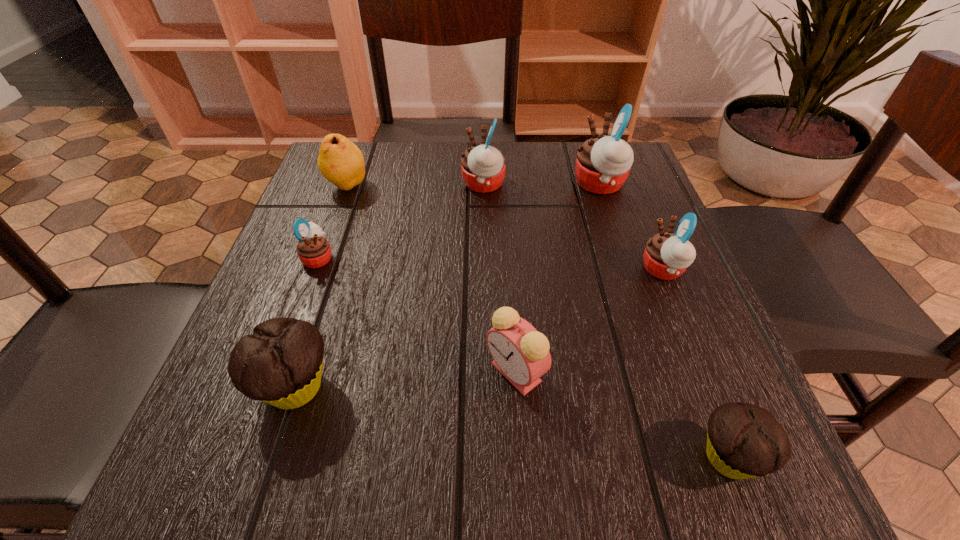
Select which muffin is the fifth closest to the bigger chocolate muffin. Please provide its 2D coordinates. Your answer should be formatted as a tuple, i.e. [(x, y)], where the tuple contains the x and y coordinates of a point satisfying the conditions above.

[(603, 163)]

Where is `muffin that is the fourth nearest to the third biggest pink muffin`? This screenshot has width=960, height=540. muffin that is the fourth nearest to the third biggest pink muffin is located at coordinates tap(281, 363).

Choose which pink muffin is the nearest neighbor to the alarm clock. Please provide its 2D coordinates. Your answer should be formatted as a tuple, i.e. [(x, y)], where the tuple contains the x and y coordinates of a point satisfying the conditions above.

[(667, 255)]

Identify which pink muffin is the second closest to the leftmost pink muffin. Please provide its 2D coordinates. Your answer should be formatted as a tuple, i.e. [(x, y)], where the tuple contains the x and y coordinates of a point satisfying the conditions above.

[(603, 163)]

What are the coordinates of `vacant space that satisfies the following two spatial constraints: 1. on the front-facing side of the fourth muffin from right to left; 2. on the back side of the smaller chocolate muffin` in the screenshot? It's located at (486, 457).

You are a GUI agent. You are given a task and a screenshot of the screen. Output one action in this format:
    pyautogui.click(x=<x>, y=<y>)
    Task: Click on the free location that satisfies the following two spatial constraints: 1. on the front-facing side of the leftmost pink muffin; 2. on the left side of the bigger chocolate muffin
    
    Given the screenshot: What is the action you would take?
    [270, 388]